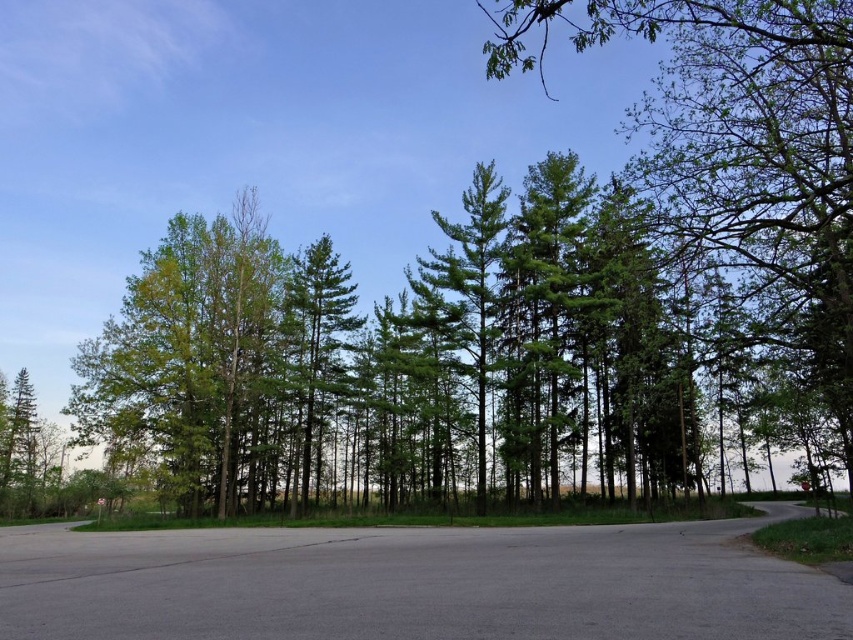
Based on the photo, is green matte tree at upper right shorter than green pine tree at center?

No, green matte tree at upper right is not shorter than green pine tree at center.

Does green matte tree at upper right have a greater width compared to green pine tree at center?

Yes, green matte tree at upper right is wider than green pine tree at center.

Does point (814, 77) come closer to viewer compared to point (292, 493)?

Yes, it is in front of point (292, 493).

Where is `green matte tree at upper right`? green matte tree at upper right is located at coordinates (740, 150).